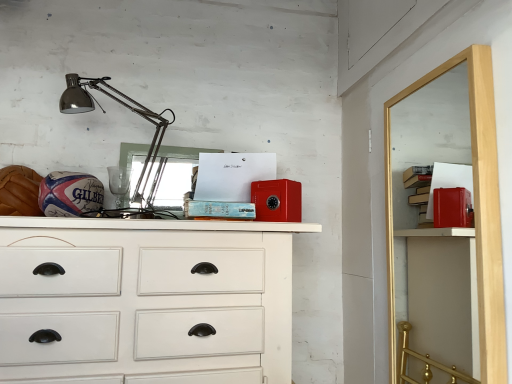
Find the location of a particular element. metallic silver lamp at upper left is located at coordinates (121, 104).

The width and height of the screenshot is (512, 384). What do you see at coordinates (145, 297) in the screenshot?
I see `white painted wood chest of drawers at center` at bounding box center [145, 297].

Find the location of `red matte safe at upper right`. red matte safe at upper right is located at coordinates (476, 208).

At what (x,y) coordinates should I click in order to perform the action: click on lamp behind the red matte safe at upper right. Please return your answer as a coordinate pair (x, y). The width and height of the screenshot is (512, 384). Looking at the image, I should click on (121, 104).

Is red matte safe at upper right thinner than metallic silver lamp at upper left?

Yes.

Measure the distance from red matte safe at upper right to metallic silver lamp at upper left.

red matte safe at upper right and metallic silver lamp at upper left are 37.92 inches apart.

From a real-world perspective, is red matte safe at upper right physically located above or below metallic silver lamp at upper left?

In terms of real-world spatial position, red matte safe at upper right is below metallic silver lamp at upper left.

From a real-world perspective, which object stands above the other?

In real-world perspective, red matte safe at upper right is above.

Is red matte safe at upper right looking in the opposite direction of white painted wood chest of drawers at center?

That's not correct — red matte safe at upper right is not looking away from white painted wood chest of drawers at center.

Considering the sizes of objects red matte safe at upper right and white painted wood chest of drawers at center in the image provided, who is shorter, red matte safe at upper right or white painted wood chest of drawers at center?

With less height is white painted wood chest of drawers at center.

Could white painted wood chest of drawers at center be considered to be inside red matte safe at upper right?

No.

From a real-world perspective, is white painted wood chest of drawers at center located beneath metallic silver lamp at upper left?

Yes, from a real-world perspective, white painted wood chest of drawers at center is under metallic silver lamp at upper left.

From the image's perspective, is white painted wood chest of drawers at center located above or below metallic silver lamp at upper left?

From the image's perspective, white painted wood chest of drawers at center appears below metallic silver lamp at upper left.

In terms of width, does white painted wood chest of drawers at center look wider or thinner when compared to metallic silver lamp at upper left?

Clearly, white painted wood chest of drawers at center has more width compared to metallic silver lamp at upper left.

Is white painted wood chest of drawers at center looking in the opposite direction of metallic silver lamp at upper left?

No, white painted wood chest of drawers at center is not facing the opposite direction of metallic silver lamp at upper left.

From the image's perspective, between metallic silver lamp at upper left and white painted wood chest of drawers at center, who is located below?

From the image's view, white painted wood chest of drawers at center is below.

Considering the positions of objects metallic silver lamp at upper left and white painted wood chest of drawers at center in the image provided, who is in front, metallic silver lamp at upper left or white painted wood chest of drawers at center?

Positioned in front is white painted wood chest of drawers at center.

Is metallic silver lamp at upper left in contact with white painted wood chest of drawers at center?

metallic silver lamp at upper left is not next to white painted wood chest of drawers at center, and they're not touching.

Considering the positions of objects metallic silver lamp at upper left and white painted wood chest of drawers at center in the image provided, who is more to the left, metallic silver lamp at upper left or white painted wood chest of drawers at center?

From the viewer's perspective, metallic silver lamp at upper left appears more on the left side.

Is metallic silver lamp at upper left next to red matte safe at upper right?

There is a gap between metallic silver lamp at upper left and red matte safe at upper right.

I want to click on file cabinet beneath the metallic silver lamp at upper left (from a real-world perspective), so click(x=476, y=208).

Between metallic silver lamp at upper left and red matte safe at upper right, which one has larger size?

metallic silver lamp at upper left is bigger.

This screenshot has height=384, width=512. Find the location of `file cabinet in front of the white painted wood chest of drawers at center`. file cabinet in front of the white painted wood chest of drawers at center is located at coordinates (476, 208).

Is the depth of white painted wood chest of drawers at center less than that of red matte safe at upper right?

No, white painted wood chest of drawers at center is further to the viewer.

Is white painted wood chest of drawers at center turned away from red matte safe at upper right?

No, white painted wood chest of drawers at center is not facing away from red matte safe at upper right.

Is white painted wood chest of drawers at center at the right side of red matte safe at upper right?

In fact, white painted wood chest of drawers at center is to the left of red matte safe at upper right.

You are a GUI agent. You are given a task and a screenshot of the screen. Output one action in this format:
    pyautogui.click(x=<x>, y=<y>)
    Task: Click on the file cabinet lying on the right of metallic silver lamp at upper left
    The width and height of the screenshot is (512, 384).
    Given the screenshot: What is the action you would take?
    (x=476, y=208)

There is a white painted wood chest of drawers at center. Find the location of `file cabinet above it (from a real-world perspective)`. file cabinet above it (from a real-world perspective) is located at coordinates (476, 208).

When comparing their distances from red matte safe at upper right, does metallic silver lamp at upper left or white painted wood chest of drawers at center seem further?

Among the two, metallic silver lamp at upper left is located further to red matte safe at upper right.

Estimate the real-world distances between objects in this image. Which object is closer to red matte safe at upper right, white painted wood chest of drawers at center or metallic silver lamp at upper left?

Based on the image, white painted wood chest of drawers at center appears to be nearer to red matte safe at upper right.

Which object lies nearer to the anchor point white painted wood chest of drawers at center, metallic silver lamp at upper left or red matte safe at upper right?

metallic silver lamp at upper left.

Based on their spatial positions, is red matte safe at upper right or metallic silver lamp at upper left closer to white painted wood chest of drawers at center?

Among the two, metallic silver lamp at upper left is located nearer to white painted wood chest of drawers at center.

Based on their spatial positions, is white painted wood chest of drawers at center or red matte safe at upper right closer to metallic silver lamp at upper left?

Among the two, white painted wood chest of drawers at center is located nearer to metallic silver lamp at upper left.

Looking at the image, which one is located closer to metallic silver lamp at upper left, red matte safe at upper right or white painted wood chest of drawers at center?

Among the two, white painted wood chest of drawers at center is located nearer to metallic silver lamp at upper left.

This screenshot has height=384, width=512. I want to click on chest of drawers between metallic silver lamp at upper left and red matte safe at upper right from left to right, so click(145, 297).